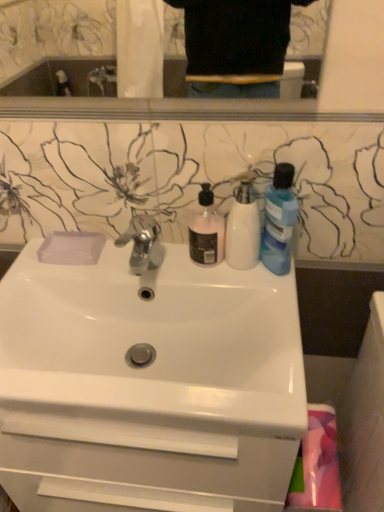
Question: In terms of width, does pink fabric at lower right look wider or thinner when compared to transparent plastic soap at upper left?

Choices:
 (A) wide
 (B) thin

Answer: (A)

Question: Considering the positions of pink fabric at lower right and transparent plastic soap at upper left in the image, is pink fabric at lower right taller or shorter than transparent plastic soap at upper left?

Choices:
 (A) short
 (B) tall

Answer: (B)

Question: Which object is positioned closest to the white glossy sink at center?

Choices:
 (A) blue translucent bottle at upper right, which is counted as the first cleaning product, starting from the right
 (B) white matte bottle at center, marked as the 2th cleaning product in a left-to-right arrangement
 (C) pink fabric at lower right
 (D) pink matte liquid soap at center, which is the 3th cleaning product from right to left
 (E) polished chrome faucet at center

Answer: (E)

Question: Which object is the farthest from the white matte bottle at center, marked as the second cleaning product in a right-to-left arrangement?

Choices:
 (A) pink matte liquid soap at center, the 1th cleaning product positioned from the left
 (B) polished chrome faucet at center
 (C) blue translucent bottle at upper right, which is counted as the 3th cleaning product, starting from the left
 (D) pink fabric at lower right
 (E) white glossy sink at center

Answer: (D)